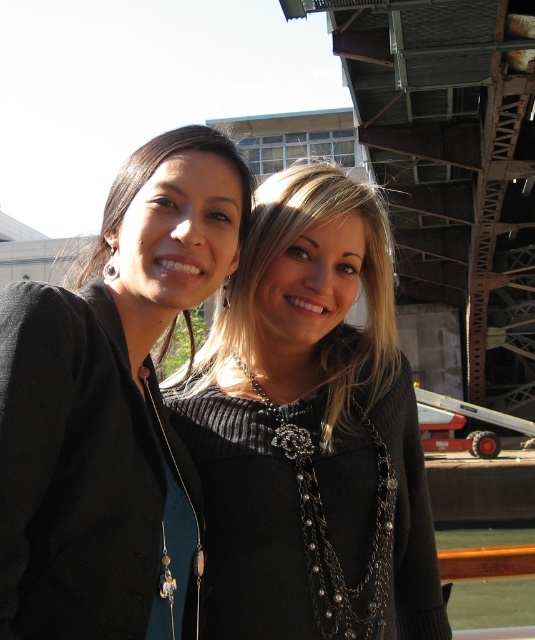
You are a photographer trying to capture a clear shot of both the matte black sweater at center and the matte black sweater at upper left. Which one should you focus on first to ensure it appears sharp in the photo?

You should focus on the matte black sweater at center first because it is closer to you than the matte black sweater at upper left, making it easier to keep in focus.